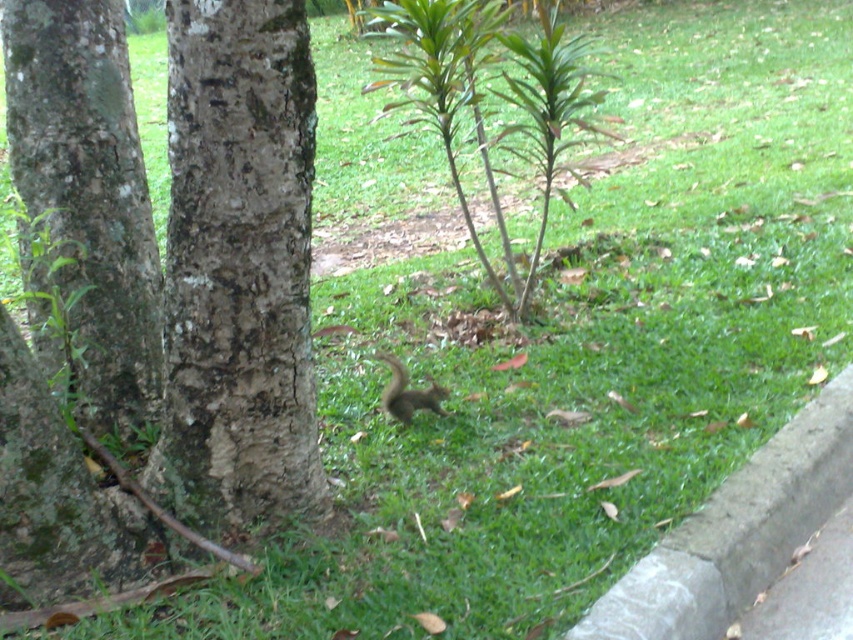
Who is positioned more to the right, rough bark tree trunk at center or gray concrete curb at lower right?

Positioned to the right is gray concrete curb at lower right.

Who is positioned more to the left, rough bark tree trunk at center or gray concrete curb at lower right?

From the viewer's perspective, rough bark tree trunk at center appears more on the left side.

Between point (263, 16) and point (717, 500), which one is positioned behind?

Positioned behind is point (717, 500).

Where is `rough bark tree trunk at center`? rough bark tree trunk at center is located at coordinates [238, 269].

The image size is (853, 640). What do you see at coordinates (238, 269) in the screenshot?
I see `rough bark tree trunk at center` at bounding box center [238, 269].

Who is positioned more to the left, rough bark tree trunk at center or gray fur squirrel at center?

rough bark tree trunk at center is more to the left.

Who is more distant from viewer, (x=192, y=236) or (x=405, y=416)?

The point (x=405, y=416) is behind.

Locate an element on the screen. The width and height of the screenshot is (853, 640). rough bark tree trunk at center is located at coordinates tap(238, 269).

Does rough bark tree at left lie in front of gray fur squirrel at center?

Yes, it is in front of gray fur squirrel at center.

Is rough bark tree at left further to camera compared to gray fur squirrel at center?

No, rough bark tree at left is in front of gray fur squirrel at center.

Is point (73, 164) behind point (396, 419)?

No, it is not.

At what (x,y) coordinates should I click in order to perform the action: click on rough bark tree at left. Please return your answer as a coordinate pair (x, y). The height and width of the screenshot is (640, 853). Looking at the image, I should click on (84, 209).